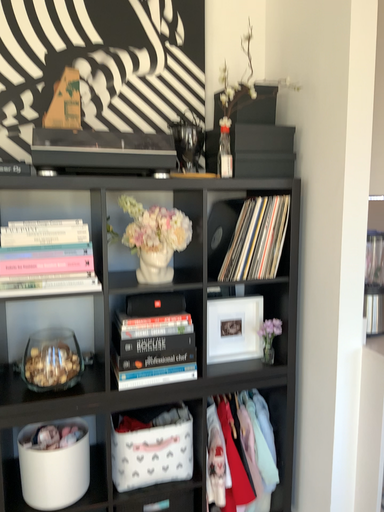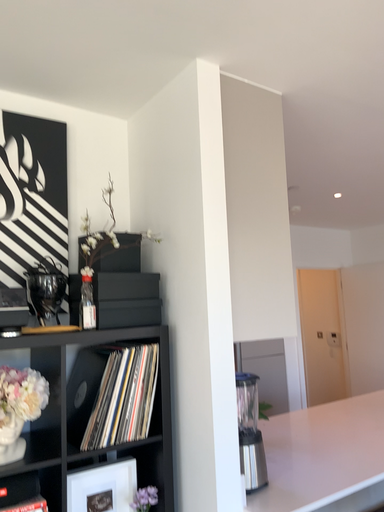
Question: Which way did the camera rotate in the video?

Choices:
 (A) rotated downward
 (B) rotated upward

Answer: (B)